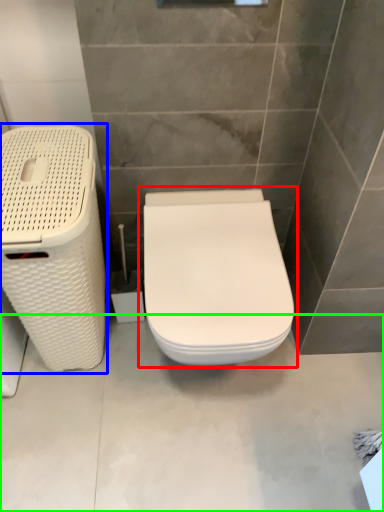
Question: Estimate the real-world distances between objects in this image. Which object is closer to toilet (highlighted by a red box), laundry basket (highlighted by a blue box) or concrete (highlighted by a green box)?

Choices:
 (A) laundry basket
 (B) concrete

Answer: (A)